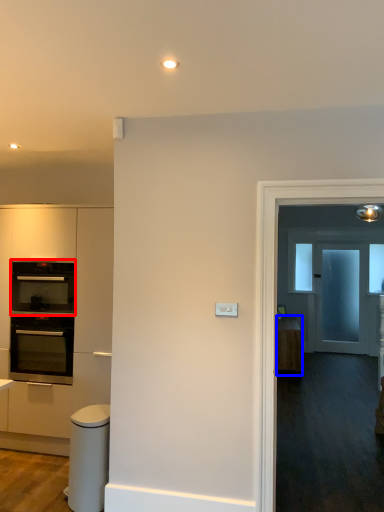
Question: Which of the following is the closest to the observer, oven (highlighted by a red box) or cabinetry (highlighted by a blue box)?

Choices:
 (A) oven
 (B) cabinetry

Answer: (A)